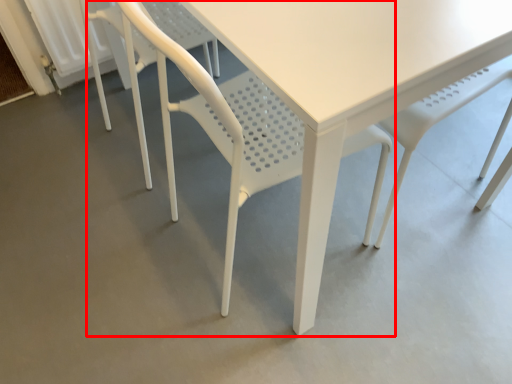
Question: In this image, where is chair (annotated by the red box) located relative to chair?

Choices:
 (A) left
 (B) right

Answer: (B)